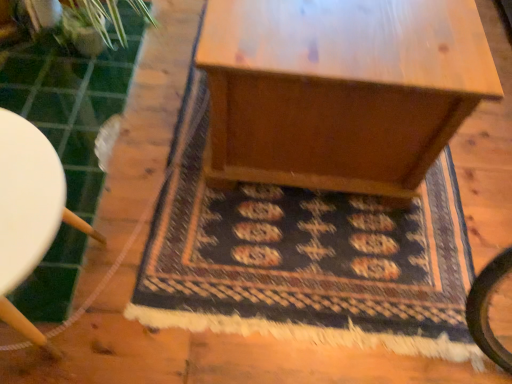
Question: Does dark blue woven rug at center have a greater height compared to white plastic stool at left?

Choices:
 (A) yes
 (B) no

Answer: (B)

Question: From a real-world perspective, is dark blue woven rug at center located beneath white plastic stool at left?

Choices:
 (A) yes
 (B) no

Answer: (A)

Question: From the image's perspective, is dark blue woven rug at center located beneath white plastic stool at left?

Choices:
 (A) yes
 (B) no

Answer: (B)

Question: From a real-world perspective, is dark blue woven rug at center on white plastic stool at left?

Choices:
 (A) no
 (B) yes

Answer: (A)

Question: Does dark blue woven rug at center have a smaller size compared to white plastic stool at left?

Choices:
 (A) no
 (B) yes

Answer: (B)

Question: Relative to wooden table at center, is dark blue woven rug at center in front or behind?

Choices:
 (A) behind
 (B) front

Answer: (A)

Question: In the image, is dark blue woven rug at center on the left side or the right side of wooden table at center?

Choices:
 (A) left
 (B) right

Answer: (A)

Question: From a real-world perspective, is dark blue woven rug at center physically located above or below wooden table at center?

Choices:
 (A) below
 (B) above

Answer: (A)

Question: Which is correct: dark blue woven rug at center is inside wooden table at center, or outside of it?

Choices:
 (A) outside
 (B) inside

Answer: (A)

Question: Considering the relative positions of dark blue woven rug at center and white plastic stool at left in the image provided, is dark blue woven rug at center to the left or to the right of white plastic stool at left?

Choices:
 (A) right
 (B) left

Answer: (A)

Question: Relative to white plastic stool at left, is dark blue woven rug at center in front or behind?

Choices:
 (A) front
 (B) behind

Answer: (B)

Question: Is dark blue woven rug at center taller or shorter than white plastic stool at left?

Choices:
 (A) tall
 (B) short

Answer: (B)

Question: Which is correct: dark blue woven rug at center is inside white plastic stool at left, or outside of it?

Choices:
 (A) inside
 (B) outside

Answer: (B)

Question: From the image's perspective, is white plastic stool at left above or below wooden table at center?

Choices:
 (A) above
 (B) below

Answer: (B)

Question: Is white plastic stool at left taller or shorter than wooden table at center?

Choices:
 (A) short
 (B) tall

Answer: (A)